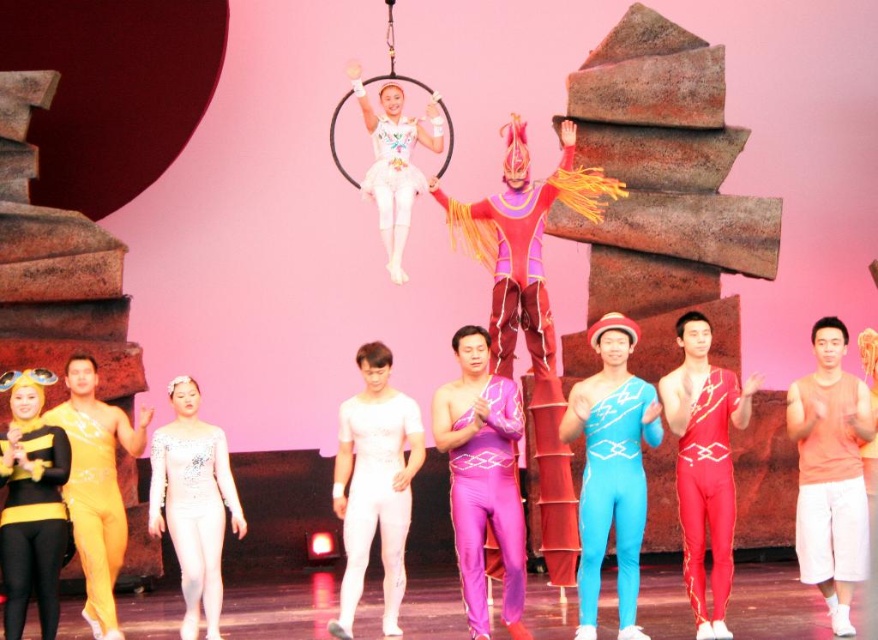
Question: Does orange fabric tank top at center have a larger size compared to shiny red leotard at center?

Choices:
 (A) no
 (B) yes

Answer: (A)

Question: Is purple matte jumpsuit at center thinner than yellow spandex bodysuit at left?

Choices:
 (A) yes
 (B) no

Answer: (A)

Question: Based on their relative distances, which object is nearer to the yellow spandex bodysuit at left?

Choices:
 (A) blue spandex jumpsuit at center
 (B) black matte bodysuit at lower left

Answer: (B)

Question: From the image, what is the correct spatial relationship of black matte bodysuit at lower left in relation to purple matte jumpsuit at center?

Choices:
 (A) left
 (B) right

Answer: (A)

Question: Among these points, which one is nearest to the camera?

Choices:
 (A) (42, 556)
 (B) (610, 484)
 (C) (373, 448)
 (D) (725, 573)

Answer: (A)

Question: Which object is farther from the camera taking this photo?

Choices:
 (A) orange fabric tank top at center
 (B) white matte leotard at center
 (C) shiny red leotard at center
 (D) black matte bodysuit at lower left

Answer: (A)